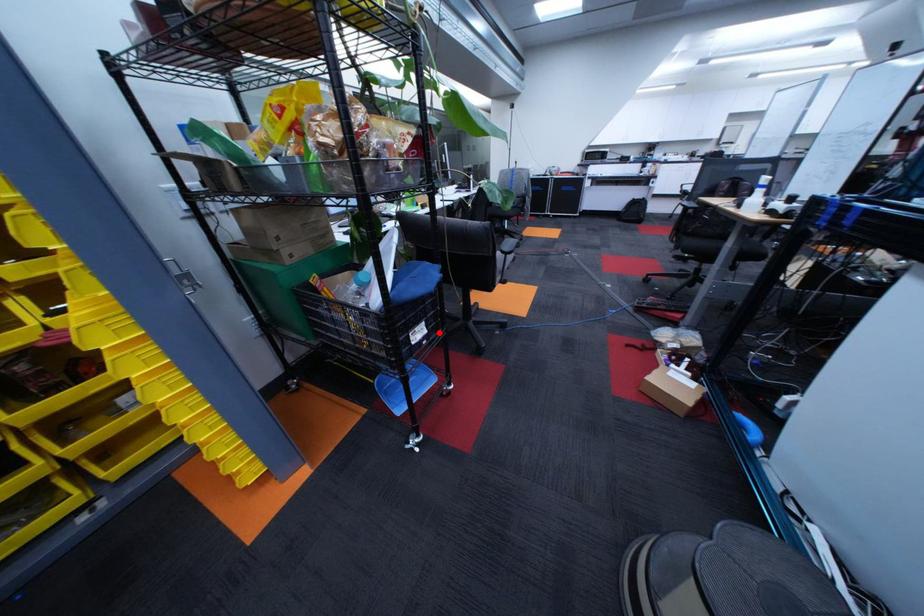
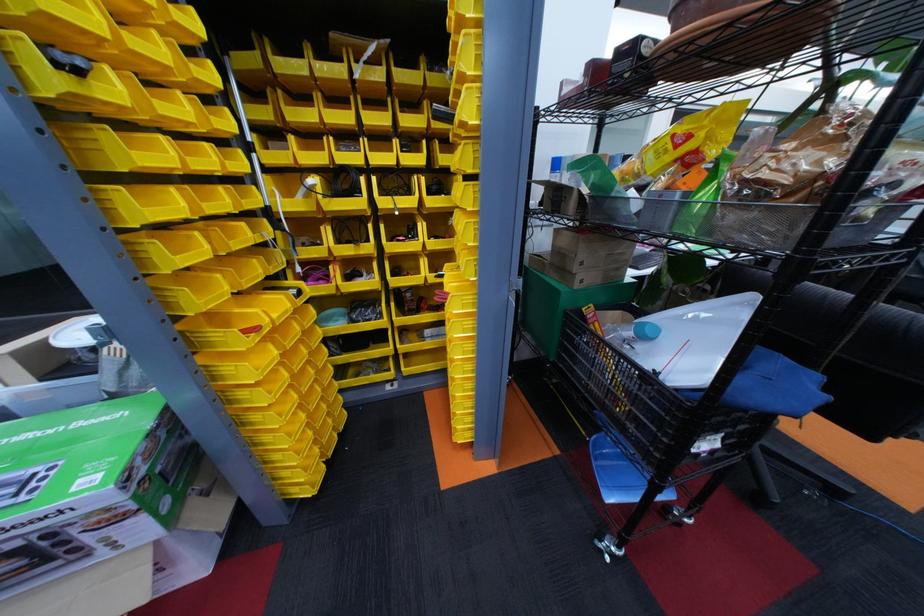
Question: I am providing you with two images of the same scene from different viewpoints. In image1, a red point is highlighted. Considering the same 3D point in image2, which of the following is correct?

Choices:
 (A) It is closer
 (B) It is farther

Answer: (B)